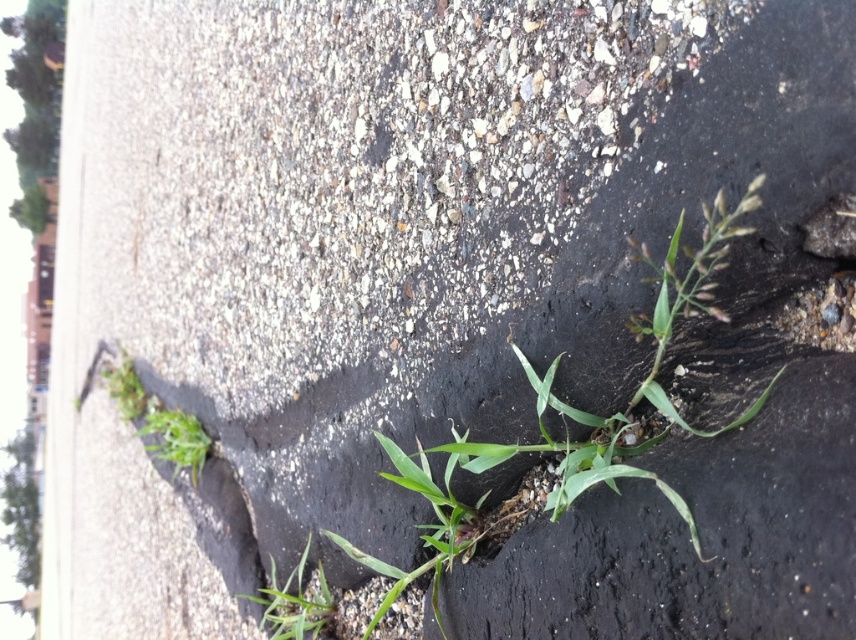
You are standing at the center of the image. Which direction should you move to reach the green leafy plant at lower center?

The green leafy plant at lower center is located at point coordinates of (295, 602), so you should move towards the lower center direction to reach it.

You are a gardener who wants to water the green leafy plant at lower center and the green leafy plant at lower left. Which plant should you water first if you want to start with the one that is closer to you?

The green leafy plant at lower center is closer to the viewer than the green leafy plant at lower left, so you should water the green leafy plant at lower center first.